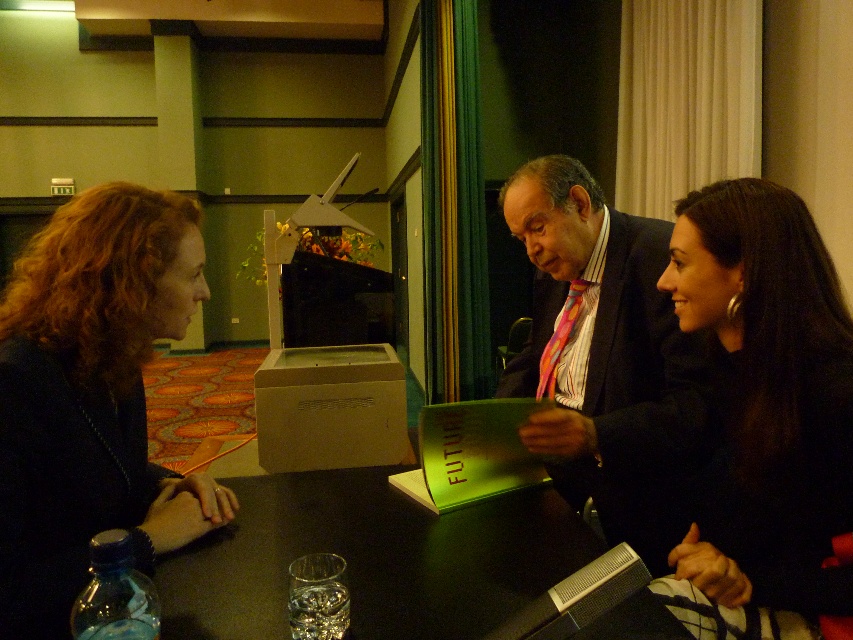
Based on the scene description, can you determine which object is taller between the dark brown hair at left and the multicolored striped tie at center?

Answer: The dark brown hair at left is shorter than the multicolored striped tie at center, so the multicolored striped tie at center is taller.

You are at a formal event and see the dark brown hair at left and the multicolored striped tie at center. Which one is more to the left?

The dark brown hair at left is more to the left than the multicolored striped tie at center.

You are at a formal event and see two people seated at the table. One has dark brown hair at left and the other has shiny black hair at center. Which person is sitting to the left of the other?

The dark brown hair at left is positioned on the left side of shiny black hair at center, so the person with dark brown hair at left is sitting to the left of the person with shiny black hair at center.